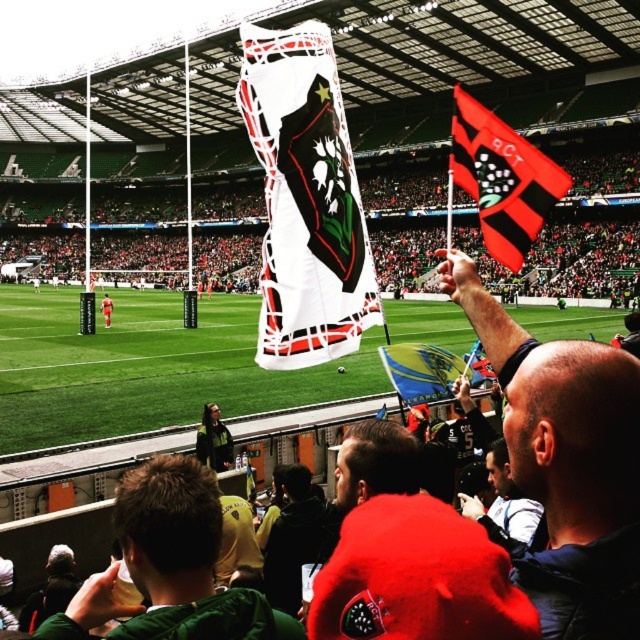
Question: Which is nearer to the red fabric flag at upper right?

Choices:
 (A) red fabric shirt at center
 (B) white fabric banner at upper center
 (C) smooth black flag at upper right
 (D) green grass football field at center

Answer: (C)

Question: Which of the following is the farthest from the observer?

Choices:
 (A) red fabric shirt at center
 (B) red fabric flag at upper right
 (C) smooth black flag at upper right

Answer: (B)

Question: Which of the following is the farthest from the observer?

Choices:
 (A) white fabric banner at upper center
 (B) green grass football field at center
 (C) white matte flag at center

Answer: (A)

Question: Considering the relative positions of green grass football field at center and green jersey at lower left in the image provided, where is green grass football field at center located with respect to green jersey at lower left?

Choices:
 (A) left
 (B) right

Answer: (A)

Question: Is smooth black flag at upper right bigger than red fabric shirt at center?

Choices:
 (A) yes
 (B) no

Answer: (A)

Question: Is white fabric banner at upper center smaller than white matte flag at center?

Choices:
 (A) yes
 (B) no

Answer: (B)